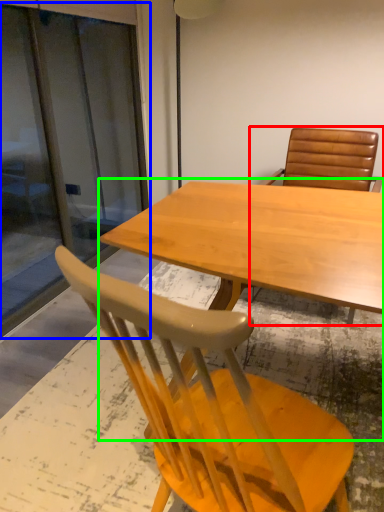
Question: Which object is the farthest from chair (highlighted by a red box)? Choose among these: screen door (highlighted by a blue box) or table (highlighted by a green box).

Choices:
 (A) screen door
 (B) table

Answer: (A)